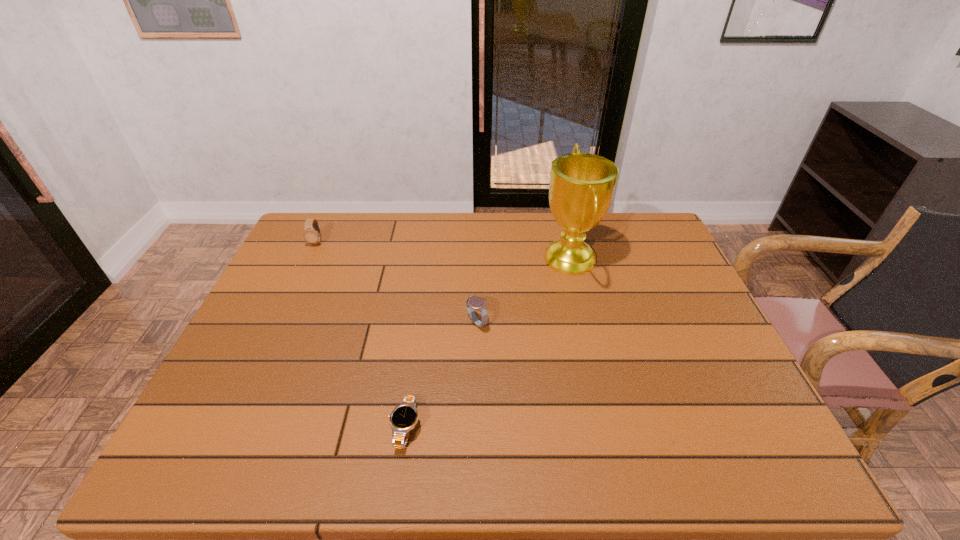
Where is `the rightmost object`? This screenshot has width=960, height=540. the rightmost object is located at coordinates point(582,185).

I want to click on award, so click(582, 185).

You are a GUI agent. You are given a task and a screenshot of the screen. Output one action in this format:
    pyautogui.click(x=<x>, y=<y>)
    Task: Click on the leftmost object
    This screenshot has width=960, height=540.
    Given the screenshot: What is the action you would take?
    pyautogui.click(x=312, y=234)

Where is `the farthest watch`? Image resolution: width=960 pixels, height=540 pixels. the farthest watch is located at coordinates (312, 234).

Where is `the second farthest watch`? The height and width of the screenshot is (540, 960). the second farthest watch is located at coordinates (472, 302).

Where is `the third farthest object`? The height and width of the screenshot is (540, 960). the third farthest object is located at coordinates (472, 302).

Identify the location of the second watch from left to right. The image size is (960, 540). (404, 417).

This screenshot has height=540, width=960. Identify the location of the third object from right to left. (404, 417).

Locate an element on the screen. This screenshot has width=960, height=540. vacant area located on the shiny surface of the award is located at coordinates (487, 259).

I want to click on vacant region located 0.170m on the shiny surface of the award, so click(x=487, y=259).